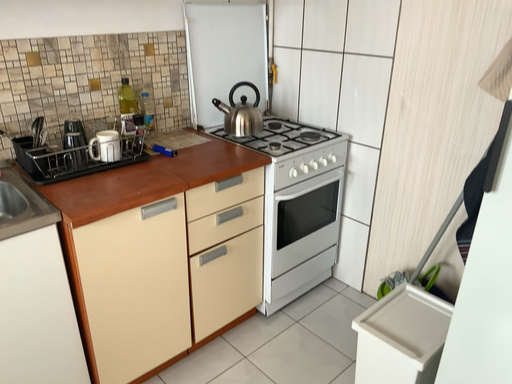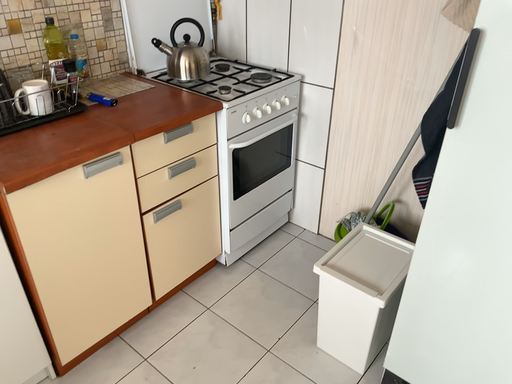
Question: Which way did the camera rotate in the video?

Choices:
 (A) rotated right
 (B) rotated left

Answer: (A)